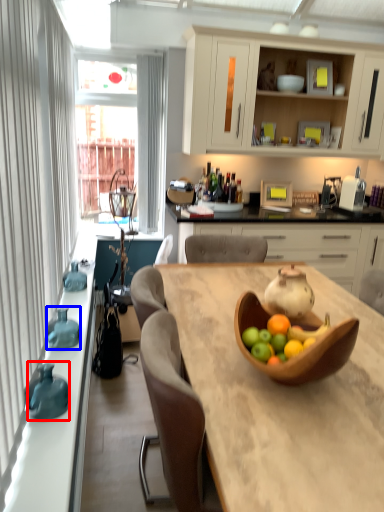
Question: Which of the following is the farthest to the observer, vase (highlighted by a red box) or vase (highlighted by a blue box)?

Choices:
 (A) vase
 (B) vase

Answer: (B)